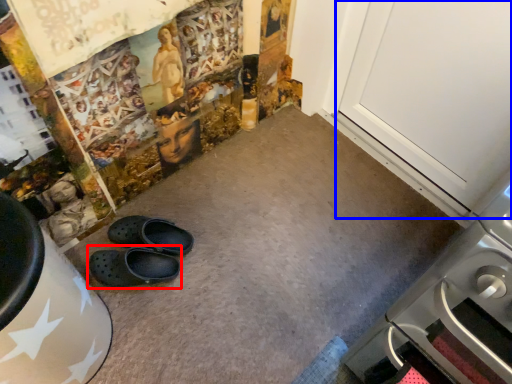
Question: Which object is further to the camera taking this photo, footwear (highlighted by a red box) or door (highlighted by a blue box)?

Choices:
 (A) footwear
 (B) door

Answer: (A)